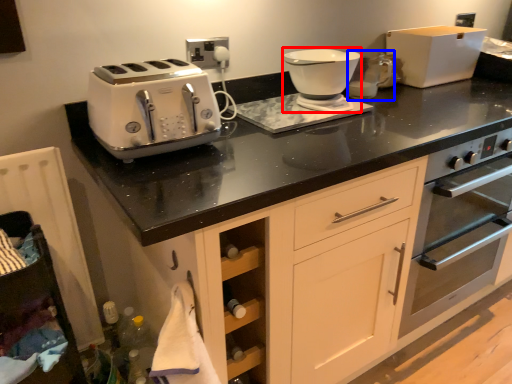
Question: Among these objects, which one is nearest to the camera, food processor (highlighted by a red box) or coffee machine (highlighted by a blue box)?

Choices:
 (A) food processor
 (B) coffee machine

Answer: (A)